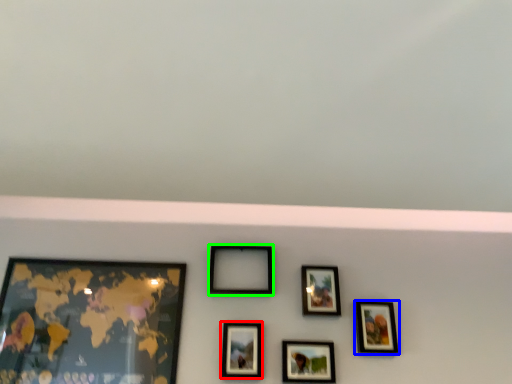
Question: Considering the real-world distances, which object is farthest from picture frame (highlighted by a red box)? picture frame (highlighted by a blue box) or picture frame (highlighted by a green box)?

Choices:
 (A) picture frame
 (B) picture frame

Answer: (A)